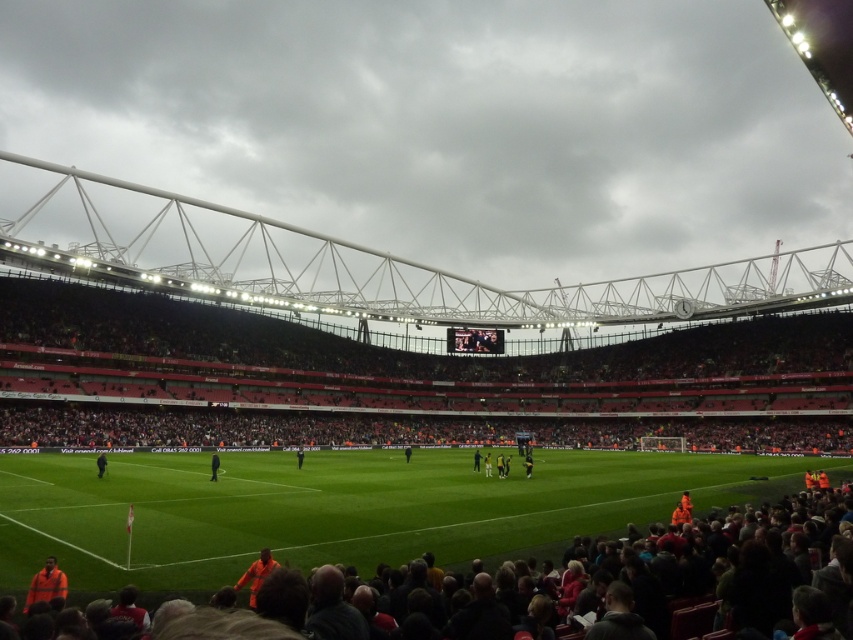
Question: Can you confirm if black jersey at center is thinner than orange safety vest at center?

Choices:
 (A) yes
 (B) no

Answer: (B)

Question: Is the position of green grass football field at center less distant than that of yellow jersey at center?

Choices:
 (A) yes
 (B) no

Answer: (A)

Question: Based on their relative distances, which object is farther from the green grass football field at center?

Choices:
 (A) high-visibility orange jacket at lower left
 (B) orange jacket at center

Answer: (A)

Question: Can you confirm if high-visibility orange jacket at lower left is wider than yellow jersey at center?

Choices:
 (A) yes
 (B) no

Answer: (B)

Question: Which point is farther from the camera taking this photo?

Choices:
 (A) 57,500
 (B) 498,476
 (C) 405,460

Answer: (C)

Question: Which is farther from the orange jacket at center?

Choices:
 (A) orange safety vest at center
 (B) high-visibility orange jacket at lower left
 (C) yellow jersey at center

Answer: (B)